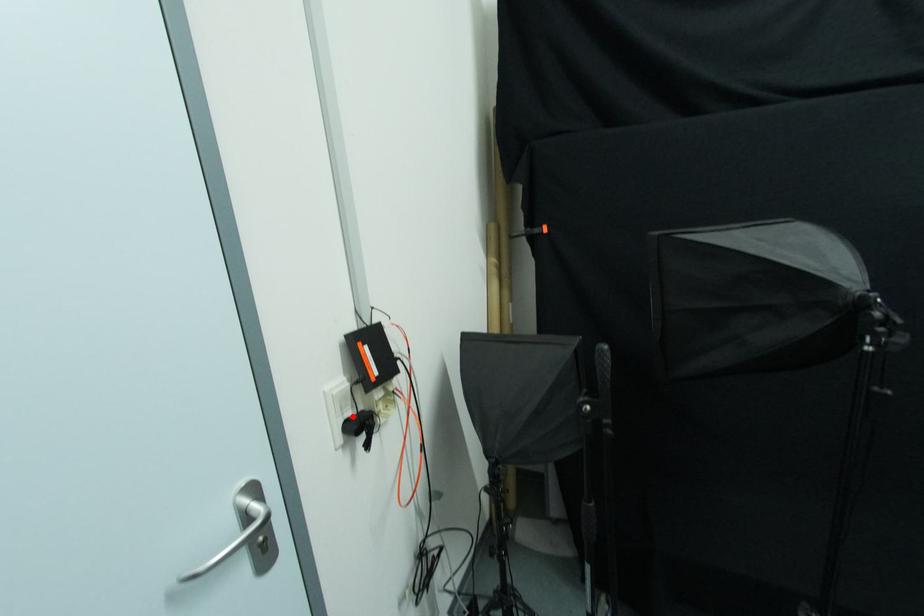
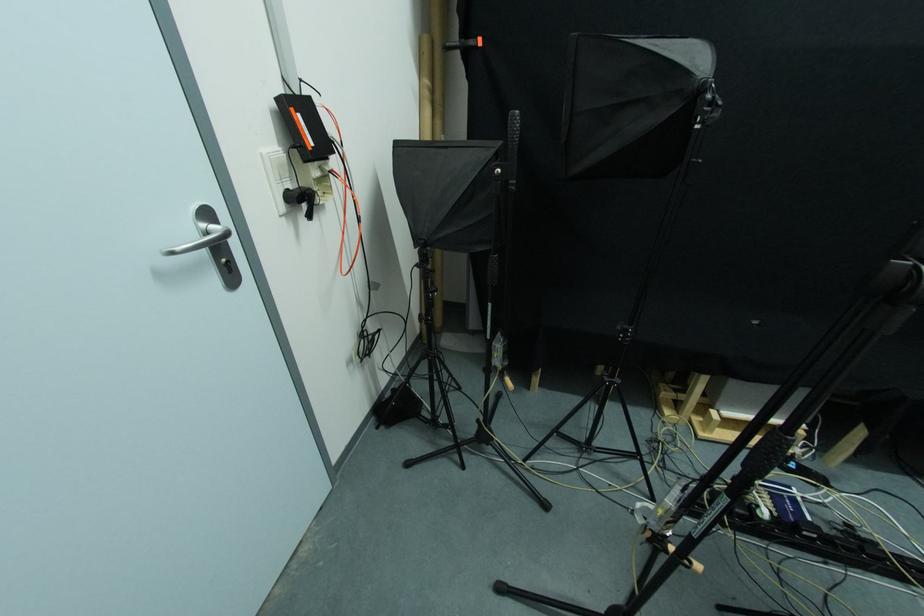
Question: I am providing you with two images of the same scene from different viewpoints. A red point is marked on the first image. At the location where the point appears in image 1, is it still visible in image 2?

Choices:
 (A) Yes
 (B) No

Answer: (A)